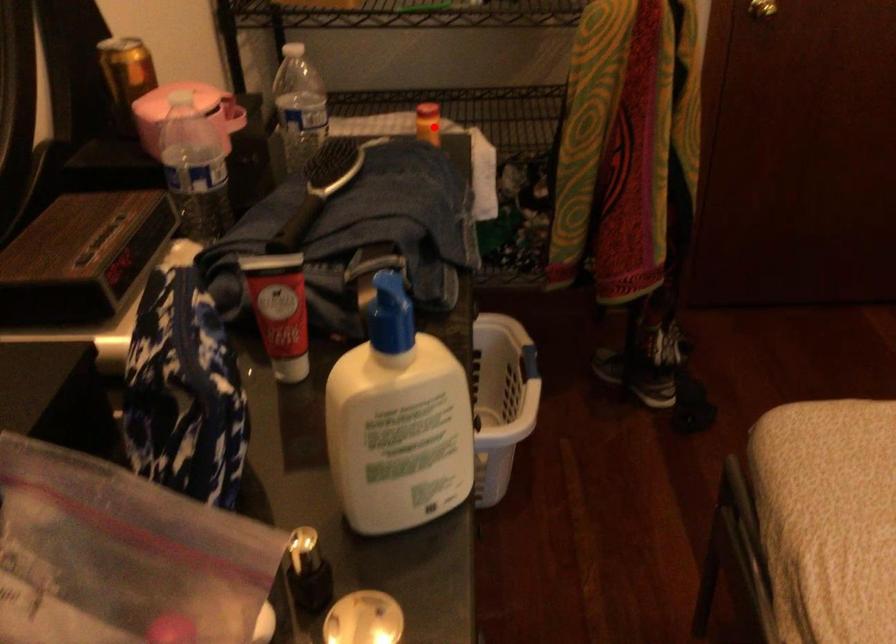
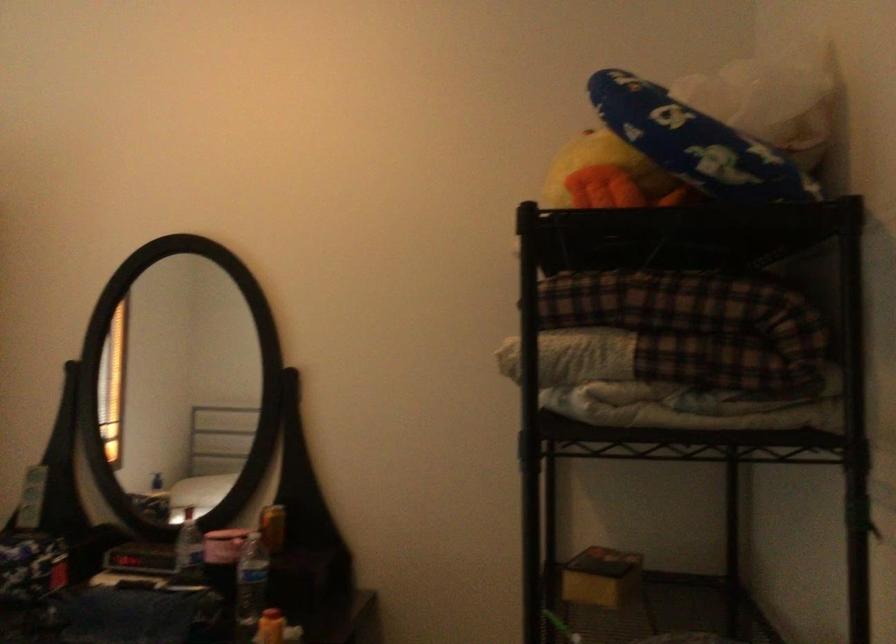
Question: I am providing you with two images of the same scene from different viewpoints. A red point is shown in image1. For the corresponding object point in image2, is it positioned nearer or farther from the camera?

Choices:
 (A) Nearer
 (B) Farther

Answer: (B)